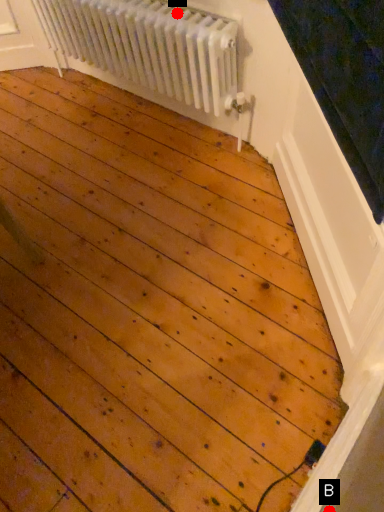
Question: Two points are circled on the image, labeled by A and B beside each circle. Which point is farther from the camera taking this photo?

Choices:
 (A) A is further
 (B) B is further

Answer: (A)